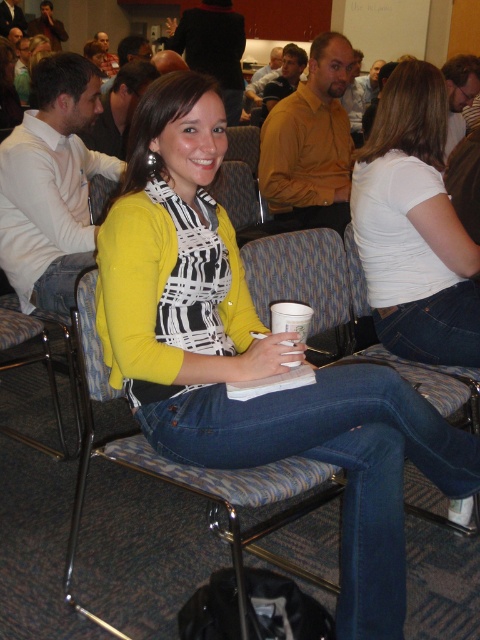
Question: Which object appears closest to the camera in this image?

Choices:
 (A) white matte shirt at center
 (B) yellow matte cardigan at center
 (C) blue denim jeans at center
 (D) denim at center

Answer: (D)

Question: Is jeans at center below blue denim jeans at center?

Choices:
 (A) yes
 (B) no

Answer: (A)

Question: Is yellow matte cardigan at center above blue denim jeans at center?

Choices:
 (A) yes
 (B) no

Answer: (B)

Question: Is yellow matte cardigan at center below white matte shirt at center?

Choices:
 (A) no
 (B) yes

Answer: (B)

Question: Which object is closer to the camera taking this photo?

Choices:
 (A) denim at center
 (B) yellow matte cardigan at center
 (C) blue fabric chair at center
 (D) blue denim jeans at center

Answer: (A)

Question: Which point is closer to the camera?

Choices:
 (A) (440, 480)
 (B) (286, 486)

Answer: (B)